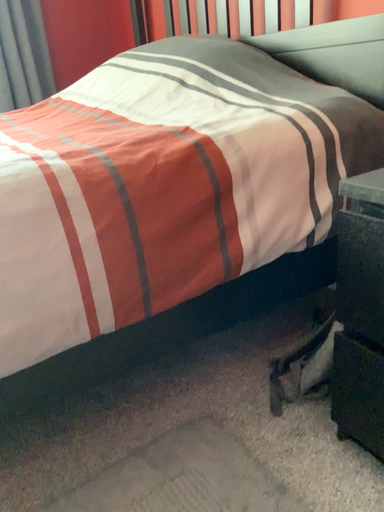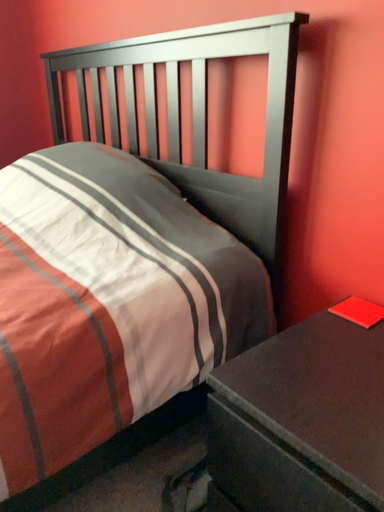
Question: Which way did the camera rotate in the video?

Choices:
 (A) rotated right
 (B) rotated left

Answer: (A)